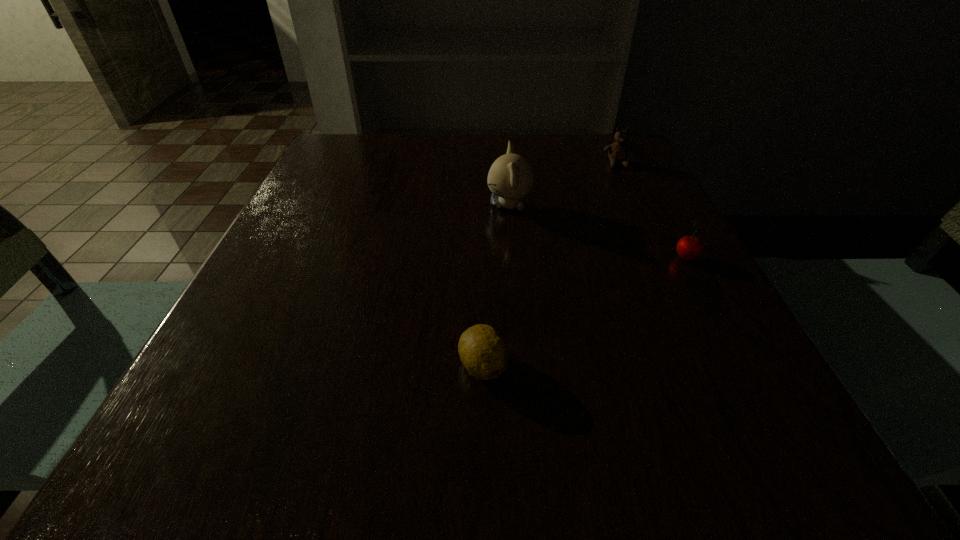
Locate an element on the screen. vacant region located 0.360m on the front-facing side of the farthest object is located at coordinates (669, 270).

I want to click on vacant area situated 0.050m at the stem end of the nearest object, so click(x=483, y=427).

Locate an element on the screen. object that is at the far edge is located at coordinates (618, 151).

What are the coordinates of `cherry that is at the right edge` in the screenshot? It's located at 689,247.

You are a GUI agent. You are given a task and a screenshot of the screen. Output one action in this format:
    pyautogui.click(x=<x>, y=<y>)
    Task: Click on the teddy bear that is positioned at the right edge
    
    Given the screenshot: What is the action you would take?
    pyautogui.click(x=618, y=151)

Identify the location of object that is at the far right corner. (618, 151).

Where is `vacant area at the far edge`? The height and width of the screenshot is (540, 960). vacant area at the far edge is located at coordinates (500, 136).

At what (x,y) coordinates should I click in order to perform the action: click on vacant space at the near edge of the desktop. Please return your answer as a coordinate pair (x, y). Looking at the image, I should click on (315, 472).

Where is `vacant region at the left edge of the desktop`? This screenshot has height=540, width=960. vacant region at the left edge of the desktop is located at coordinates (348, 197).

Locate an element on the screen. free space at the right edge is located at coordinates (687, 295).